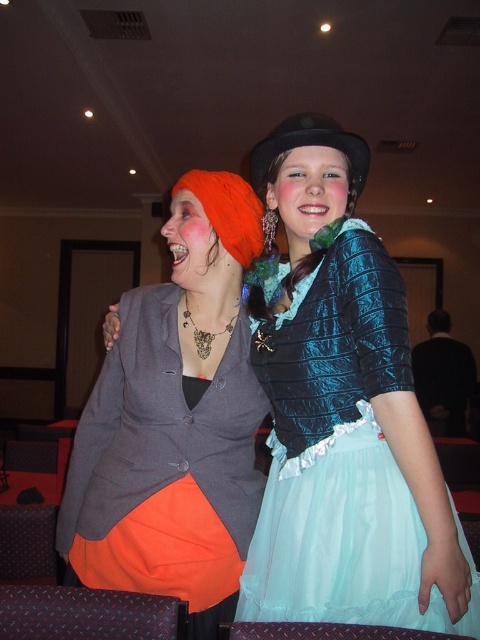
Does orange matte skirt at center appear on the left side of teal satin dress at center?

Yes, orange matte skirt at center is to the left of teal satin dress at center.

The height and width of the screenshot is (640, 480). In order to click on orange matte skirt at center in this screenshot , I will do `click(176, 420)`.

This screenshot has height=640, width=480. I want to click on orange matte skirt at center, so click(176, 420).

Can you confirm if teal satin dress at center is shorter than black felt hat at upper center?

No, teal satin dress at center is not shorter than black felt hat at upper center.

Where is `teal satin dress at center`? teal satin dress at center is located at coordinates point(339,456).

Is the position of orange matte skirt at center more distant than that of black felt hat at upper center?

No.

Does orange matte skirt at center come in front of black felt hat at upper center?

Yes, orange matte skirt at center is in front of black felt hat at upper center.

This screenshot has height=640, width=480. Find the location of `orange matte skirt at center`. orange matte skirt at center is located at coordinates (176, 420).

You are a GUI agent. You are given a task and a screenshot of the screen. Output one action in this format:
    pyautogui.click(x=<x>, y=<y>)
    Task: Click on the orange matte skirt at center
    The height and width of the screenshot is (640, 480).
    Given the screenshot: What is the action you would take?
    pyautogui.click(x=176, y=420)